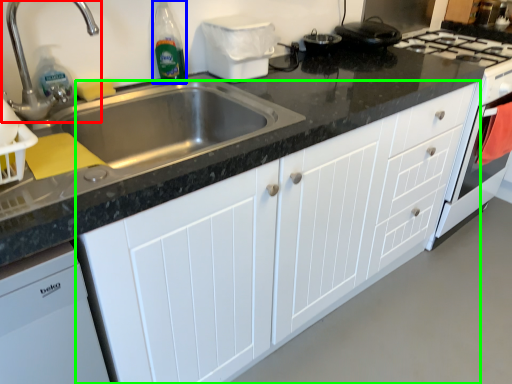
Question: Considering the real-world distances, which object is closest to tap (highlighted by a red box)? bottle (highlighted by a blue box) or cabinetry (highlighted by a green box).

Choices:
 (A) bottle
 (B) cabinetry

Answer: (A)